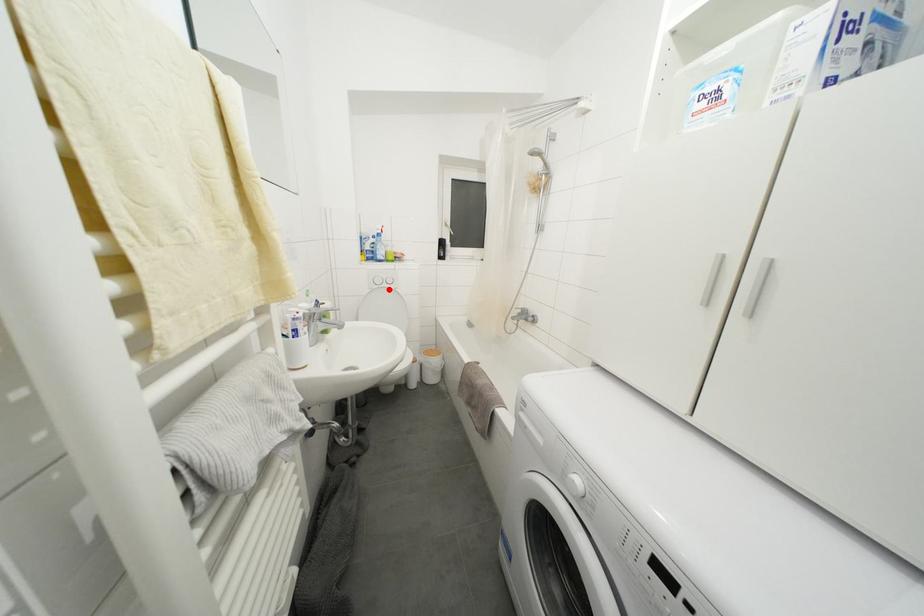
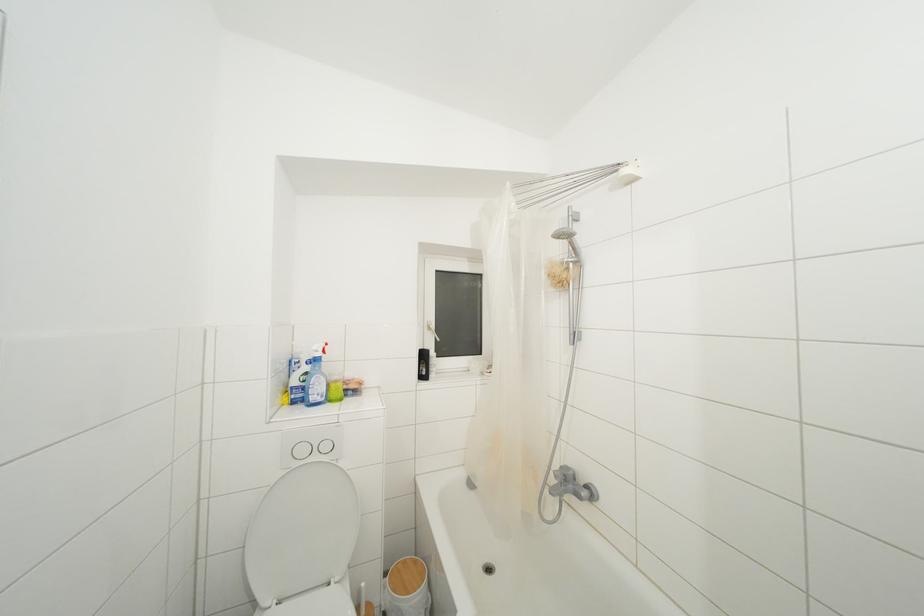
Question: I am providing you with two images of the same scene from different viewpoints. A red point is marked on the first image. Is the red point's position out of view in image 2?

Choices:
 (A) Yes
 (B) No

Answer: (B)